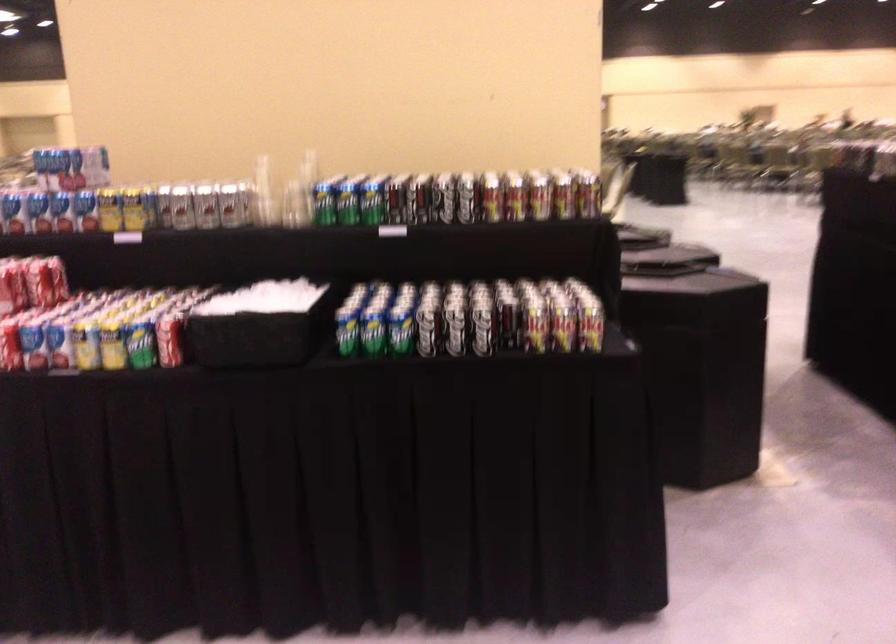
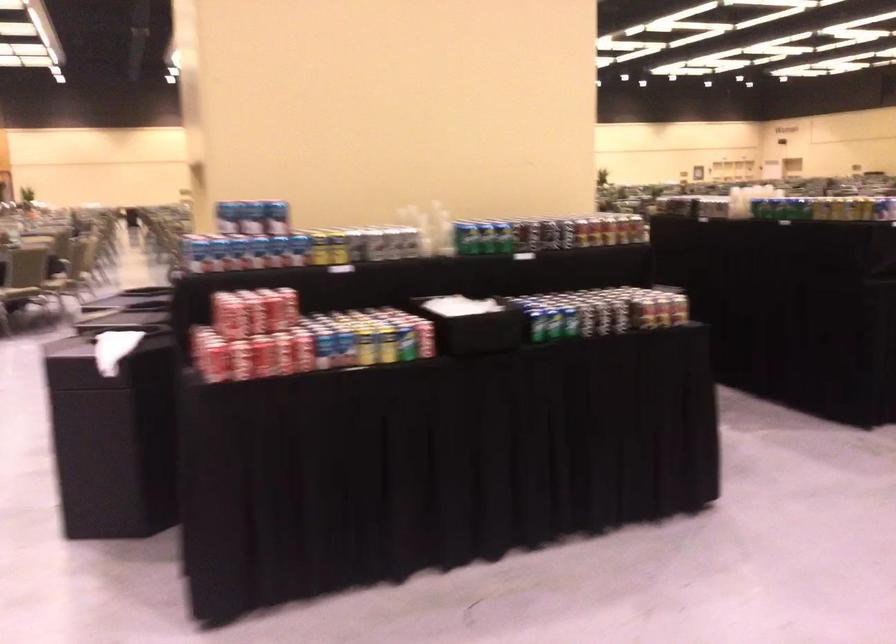
Find the pixel in the second image that matches point (220, 204) in the first image.

(395, 242)